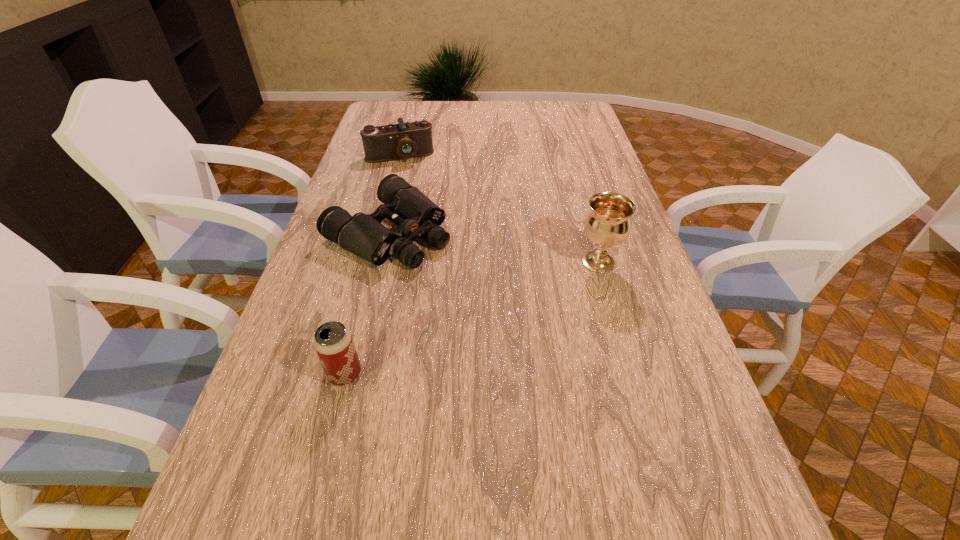
At what (x,y) coordinates should I click in order to perform the action: click on free space at the right edge of the desktop. Please return your answer as a coordinate pair (x, y). This screenshot has width=960, height=540. Looking at the image, I should click on (616, 308).

Locate an element on the screen. The height and width of the screenshot is (540, 960). free region at the far left corner is located at coordinates (392, 104).

Identify the location of free space at the near left corner of the desktop. (249, 471).

This screenshot has width=960, height=540. I want to click on free space at the far right corner of the desktop, so click(558, 102).

Where is `unoccupied area between the binoculars and the tallest object`? This screenshot has height=540, width=960. unoccupied area between the binoculars and the tallest object is located at coordinates click(493, 247).

Image resolution: width=960 pixels, height=540 pixels. Find the location of `free spot between the chalice and the camera`. free spot between the chalice and the camera is located at coordinates (499, 210).

Locate an element on the screen. The height and width of the screenshot is (540, 960). vacant space in between the chalice and the farthest object is located at coordinates 499,210.

Where is `free space between the binoculars and the rightmost object`? This screenshot has height=540, width=960. free space between the binoculars and the rightmost object is located at coordinates (493, 247).

You are a GUI agent. You are given a task and a screenshot of the screen. Output one action in this format:
    pyautogui.click(x=<x>, y=<y>)
    Task: Click on the free spot between the camera and the nearest object
    This screenshot has width=960, height=540.
    Given the screenshot: What is the action you would take?
    pyautogui.click(x=372, y=265)

Locate an element on the screen. The width and height of the screenshot is (960, 540). free space between the tallest object and the camera is located at coordinates (499, 210).